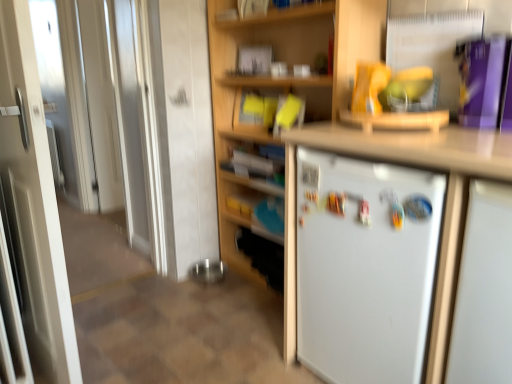
Describe the element at coordinates (412, 164) in the screenshot. The image size is (512, 384). I see `white matte refrigerator at right` at that location.

This screenshot has width=512, height=384. I want to click on beige tile at lower center, so click(x=182, y=333).

Looking at this image, which is less distant, (460, 351) or (456, 128)?

The point (460, 351) is closer to the camera.

From a real-world perspective, is white matte refrigerator at center positioned under white matte refrigerator at right based on gravity?

Indeed, from a real-world perspective, white matte refrigerator at center is positioned beneath white matte refrigerator at right.

Which of these two, white matte refrigerator at center or white matte refrigerator at right, stands taller?

With more height is white matte refrigerator at center.

Find the location of a particular element. Image resolution: width=512 pixels, height=384 pixels. appliance below the white matte refrigerator at right (from the image's perspective) is located at coordinates (484, 290).

Identify the location of door that is on the left side of white matte refrigerator at right. (34, 200).

Is white glossy door at left to the right of white matte refrigerator at right from the viewer's perspective?

In fact, white glossy door at left is to the left of white matte refrigerator at right.

Considering their positions, is white glossy door at left located in front of or behind white matte refrigerator at right?

white glossy door at left is behind white matte refrigerator at right.

Between white glossy door at left and white matte refrigerator at right, which one has larger width?

With larger width is white matte refrigerator at right.

Does white glossy door at left touch white matte refrigerator at center?

No, white glossy door at left is not beside white matte refrigerator at center.

Could you tell me if white glossy door at left is facing white matte refrigerator at center?

Yes, white glossy door at left is oriented towards white matte refrigerator at center.

Is white glossy door at left thinner than white matte refrigerator at center?

Yes.

Is beige tile at lower center not near white matte refrigerator at center?

beige tile at lower center is far away from white matte refrigerator at center.

Does point (215, 343) lie behind point (494, 252)?

Yes.

Does beige tile at lower center have a smaller size compared to white matte refrigerator at center?

Indeed, beige tile at lower center has a smaller size compared to white matte refrigerator at center.

From a real-world perspective, is white matte refrigerator at center physically located above or below beige tile at lower center?

From a real-world perspective, white matte refrigerator at center is physically above beige tile at lower center.

Considering the relative sizes of white matte refrigerator at center and beige tile at lower center in the image provided, is white matte refrigerator at center taller than beige tile at lower center?

Correct, white matte refrigerator at center is much taller as beige tile at lower center.

What's the angular difference between white matte refrigerator at center and beige tile at lower center's facing directions?

white matte refrigerator at center and beige tile at lower center are facing 90.3 degrees away from each other.

Locate an element on the screen. appliance above the beige tile at lower center (from the image's perspective) is located at coordinates (484, 290).

Considering the relative sizes of white matte refrigerator at center and wooden bookshelf at center in the image provided, is white matte refrigerator at center bigger than wooden bookshelf at center?

No.

Which object is further away from the camera taking this photo, white matte refrigerator at center or wooden bookshelf at center?

wooden bookshelf at center is further from the camera.

Is white matte refrigerator at center far away from wooden bookshelf at center?

white matte refrigerator at center is far away from wooden bookshelf at center.

Is white matte refrigerator at center positioned with its back to wooden bookshelf at center?

white matte refrigerator at center is not turned away from wooden bookshelf at center.

The image size is (512, 384). What are the coordinates of `screen door behind the white matte refrigerator at right` in the screenshot? It's located at (103, 110).

How many degrees apart are the facing directions of white glossy door at left and white matte refrigerator at right?

89.2 degrees separate the facing orientations of white glossy door at left and white matte refrigerator at right.

Is white glossy door at left positioned far away from white matte refrigerator at right?

→ Indeed, white glossy door at left is not near white matte refrigerator at right.

Which of these two, white glossy door at left or white matte refrigerator at right, stands taller?

Standing taller between the two is white glossy door at left.

You are a GUI agent. You are given a task and a screenshot of the screen. Output one action in this format:
    pyautogui.click(x=<x>, y=<y>)
    Task: Click on the cabinetry on the left of the white matte refrigerator at center
    This screenshot has width=512, height=384.
    Given the screenshot: What is the action you would take?
    pyautogui.click(x=412, y=164)

Locate an element on the screen. The width and height of the screenshot is (512, 384). cabinetry that appears below the white glossy door at left (from a real-world perspective) is located at coordinates (412, 164).

Based on their spatial positions, is beige tile at lower center or white matte refrigerator at right further from white glossy door at left?

white matte refrigerator at right.

Looking at the image, which one is located closer to white matte refrigerator at right, beige tile at lower center or white glossy door at left?

beige tile at lower center is positioned closer to the anchor white matte refrigerator at right.

Considering their positions, is white glossy door at left positioned closer to white matte refrigerator at center than white glossy door at left?

The object closer to white matte refrigerator at center is white glossy door at left.

Based on their spatial positions, is beige tile at lower center or white matte refrigerator at center further from white matte refrigerator at right?

The object further to white matte refrigerator at right is beige tile at lower center.

Which object lies further to the anchor point beige tile at lower center, white matte refrigerator at center or white matte refrigerator at right?

white matte refrigerator at center.

Looking at the image, which one is located closer to beige tile at lower center, white matte refrigerator at right or white glossy door at left?

white glossy door at left.

Which object lies nearer to the anchor point white glossy door at left, white matte refrigerator at right or wooden bookshelf at center?

Based on the image, wooden bookshelf at center appears to be nearer to white glossy door at left.

In the scene shown: Looking at the image, which one is located further to beige tile at lower center, white matte refrigerator at right or wooden bookshelf at center?

The object further to beige tile at lower center is wooden bookshelf at center.

Locate an element on the screen. The height and width of the screenshot is (384, 512). screen door between white glossy door at left and white matte refrigerator at right is located at coordinates (103, 110).

Identify the location of bookshelf between white glossy door at left and white matte refrigerator at center from left to right. The image size is (512, 384). (281, 85).

Find the location of a particular element. The image size is (512, 384). cabinetry between beige tile at lower center and white matte refrigerator at center from left to right is located at coordinates (412, 164).

Image resolution: width=512 pixels, height=384 pixels. Identify the location of tile between white glossy door at left and white matte refrigerator at center. (182, 333).